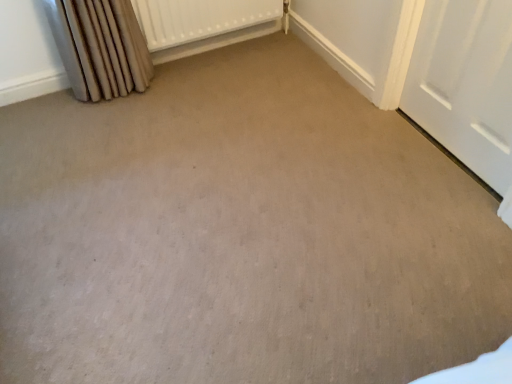
Question: From the image's perspective, is white matte door at right above or below beige fabric curtain at left?

Choices:
 (A) above
 (B) below

Answer: (B)

Question: Does point (408, 112) appear closer or farther from the camera than point (138, 89)?

Choices:
 (A) farther
 (B) closer

Answer: (B)

Question: Based on their relative distances, which object is farther from the beige fabric curtain at left?

Choices:
 (A) white textured radiator at upper center
 (B) white matte door at right

Answer: (B)

Question: Estimate the real-world distances between objects in this image. Which object is closer to the beige fabric curtain at left?

Choices:
 (A) white matte door at right
 (B) white textured radiator at upper center

Answer: (B)